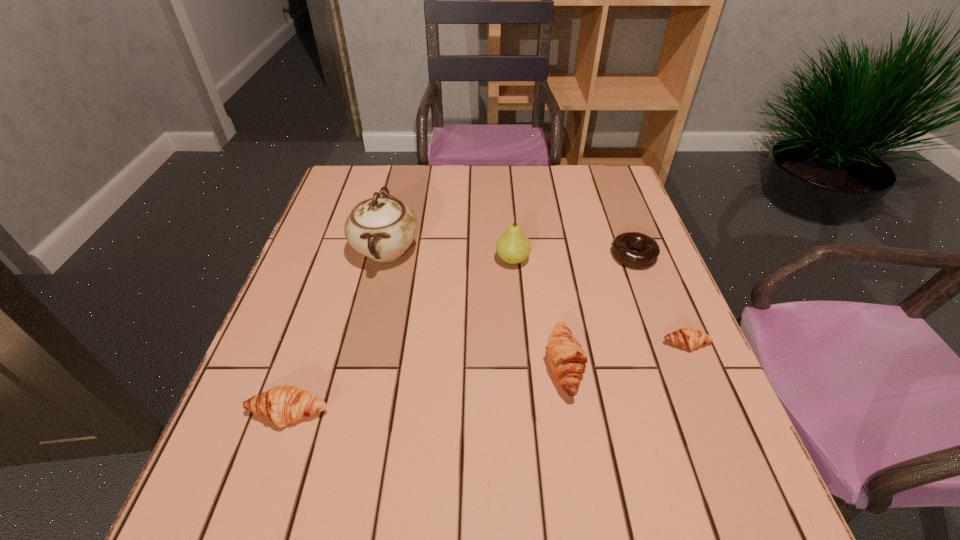
If equal spacing is desired by inserting an extra pastry among them, please point out a free spot for this new pastry. Please provide its 2D coordinates. Your answer should be formatted as a tuple, i.e. [(x, y)], where the tuple contains the x and y coordinates of a point satisfying the conditions above.

[(433, 388)]